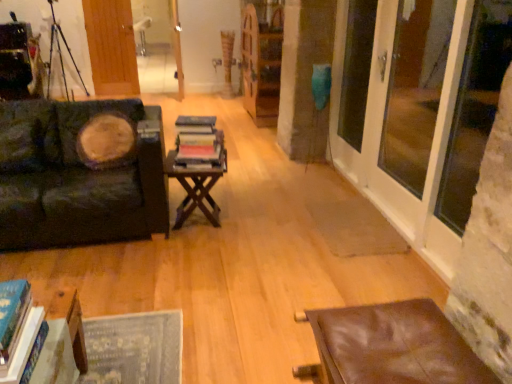
Question: Do you think metallic tripod at upper left is within wooden bookcase at center, or outside of it?

Choices:
 (A) outside
 (B) inside

Answer: (A)

Question: From a real-world perspective, is metallic tripod at upper left above or below wooden bookcase at center?

Choices:
 (A) below
 (B) above

Answer: (B)

Question: Considering the real-world distances, which object is closest to the transparent glass door at right, which ranks as the third window screen in front-to-back order?

Choices:
 (A) metallic tripod at upper left
 (B) wooden table at lower left, the 1th table in the front-to-back sequence
 (C) velvet dark green couch at left
 (D) brown wooden table at center, placed as the third table when sorted from bottom to top
 (E) wooden bookcase at center

Answer: (D)

Question: Which object is the closest to the wooden door at upper left?

Choices:
 (A) hardcover books at center
 (B) transparent glass door at right, which ranks as the third window screen in front-to-back order
 (C) metallic tripod at upper left
 (D) wooden bookcase at center
 (E) transparent glass door at right, the 2th window screen positioned from the back

Answer: (C)